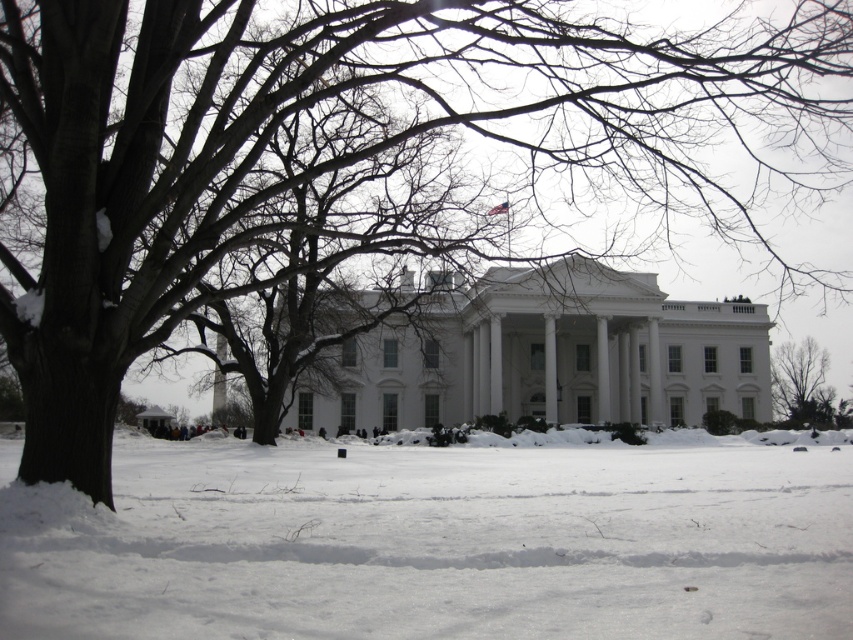
You are a photographer planning to capture a wide shot of the White House with both the white fluffy snow at center and the bare branches at lower right in the frame. Given that your camera has a maximum focal length of 50 meters, will you be able to include both elements in the same photo?

The white fluffy snow at center and the bare branches at lower right are 75.14 meters apart. Since your camera can only capture up to 50 meters, you won cannot include both elements in the same photo.

You are planning to take a photo of the White House with your camera. You want to include both the white fluffy snow at center and the bare branches at lower right in the frame. Which object should you focus on to ensure both are in the shot?

You should focus on the white fluffy snow at center because its width is greater than the bare branches at lower right, allowing both to fit within the camera frame.